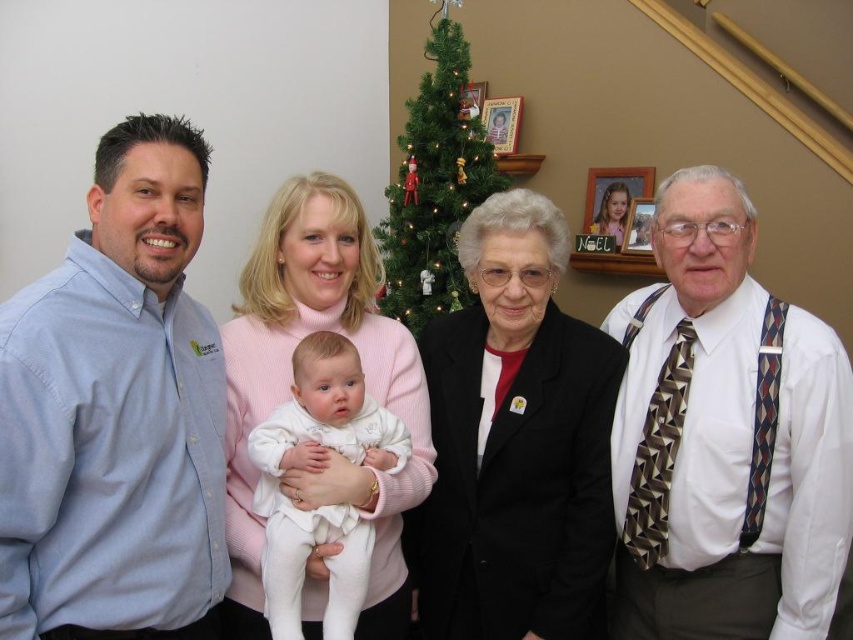
Between white textured shirt at right and matte pink sweater at center, which one appears on the left side from the viewer's perspective?

matte pink sweater at center

Which is behind, point (709, 166) or point (270, 220)?

Positioned behind is point (270, 220).

Where is `white textured shirt at right`? white textured shirt at right is located at coordinates (723, 438).

Between point (743, 468) and point (350, 524), which one is positioned behind?

Positioned behind is point (743, 468).

Is point (659, 618) closer to camera compared to point (312, 541)?

No, (659, 618) is behind (312, 541).

Identify the location of white textured shirt at right. (723, 438).

At what (x,y) coordinates should I click in order to perform the action: click on white textured shirt at right. Please return your answer as a coordinate pair (x, y). The width and height of the screenshot is (853, 640). Looking at the image, I should click on (723, 438).

Which is below, light blue button-down shirt at left or white soft fabric baby at center?

white soft fabric baby at center

Locate an element on the screen. The width and height of the screenshot is (853, 640). light blue button-down shirt at left is located at coordinates (115, 412).